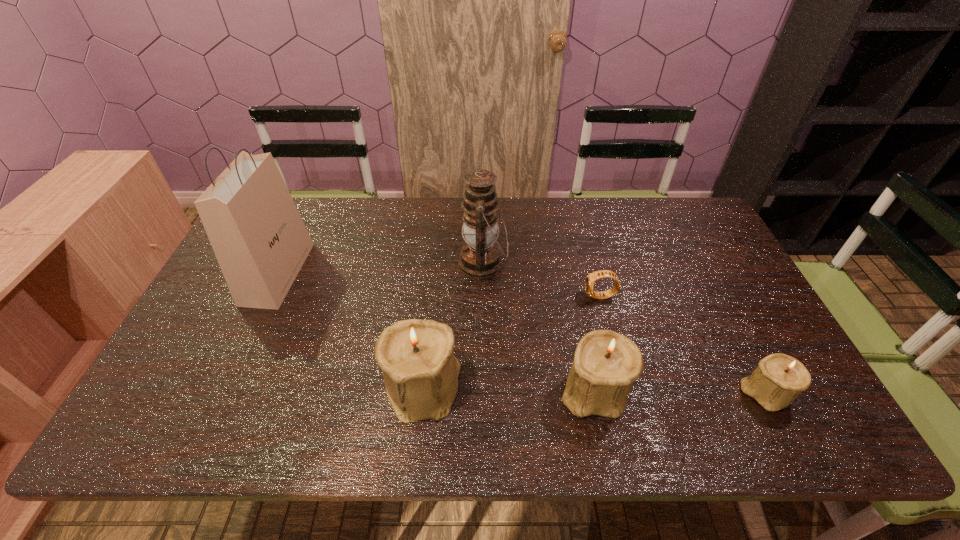
Please show where to add a candle_holder on the left while keeping spacing even. Please provide its 2D coordinates. Your answer should be formatted as a tuple, i.e. [(x, y)], where the tuple contains the x and y coordinates of a point satisfying the conditions above.

[(254, 383)]